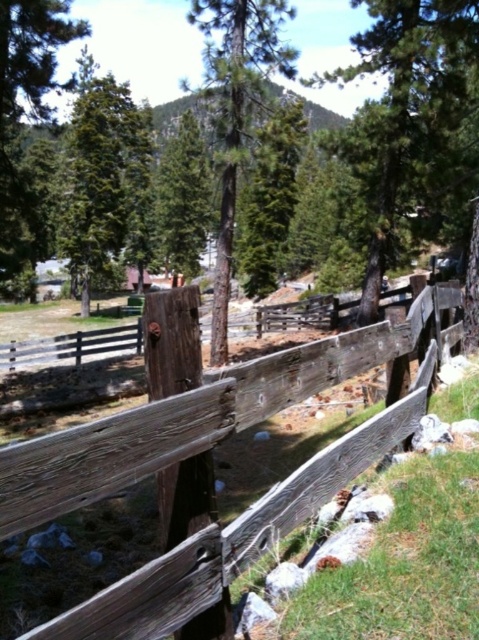
Based on the photo, you are standing at the origin point in the image. Where is the weathered wood fence at center located in terms of coordinates?

The weathered wood fence at center is located at coordinates point [212,468].

Based on the photo, you are standing in front of the weathered wood fence at center and looking towards the green matte tree at upper left. Which object appears taller from your perspective?

The green matte tree at upper left appears taller than the weathered wood fence at center because the weathered wood fence at center has a lesser height compared to the green matte tree at upper left.

You are standing in front of the rustic wooden fence and notice two trees in the distance. Which tree is positioned to the right when looking at the smooth brown tree at center and the green matte tree at upper center?

The smooth brown tree at center is positioned to the right of the green matte tree at upper center.